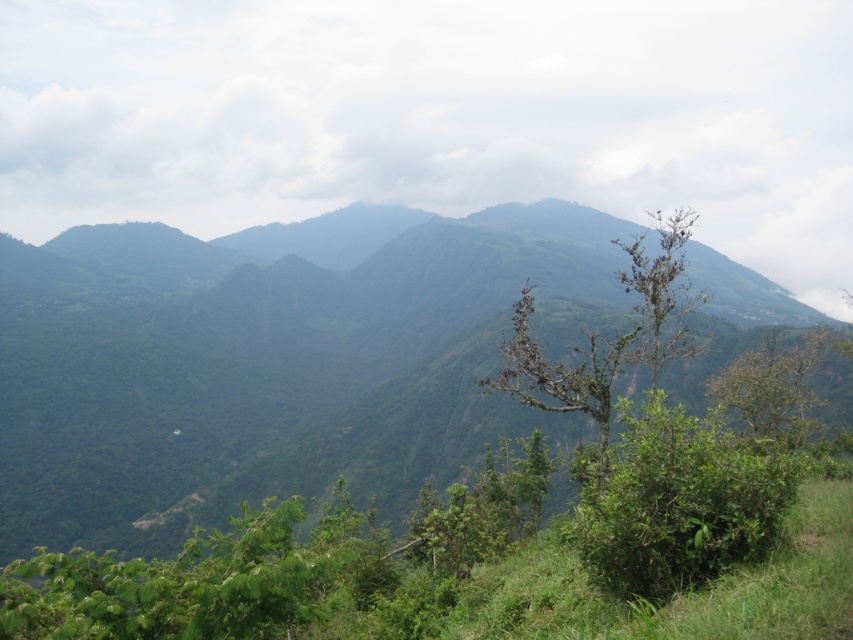
You are standing in the lush mountainous landscape and want to take a photo of both the green leafy mountain at center and the green leafy tree at right. Which object should you position to your left side to include both in the frame?

The green leafy mountain at center should be positioned to your left side because it is located to the left of the green leafy tree at right, allowing both to be captured in the frame.

Based on the scene description, which object is taller between the green leafy mountain at center and the green leafy tree at right?

The green leafy mountain at center is taller than the green leafy tree at right.